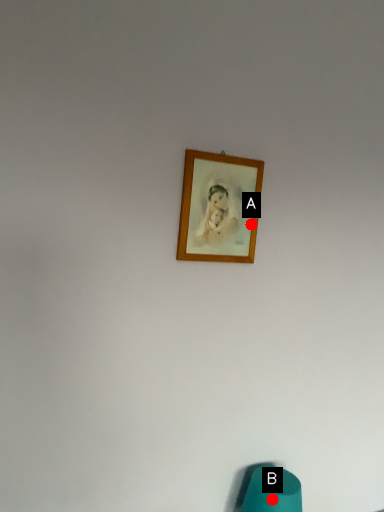
Question: Two points are circled on the image, labeled by A and B beside each circle. Which point appears closest to the camera in this image?

Choices:
 (A) A is closer
 (B) B is closer

Answer: (B)